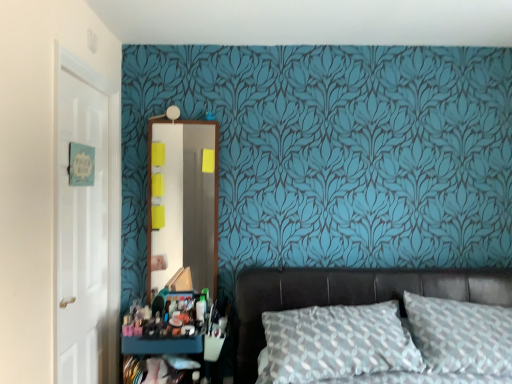
Question: From a real-world perspective, is white glossy door at left under leather bed at lower right?

Choices:
 (A) yes
 (B) no

Answer: (B)

Question: Is white glossy door at left behind leather bed at lower right?

Choices:
 (A) no
 (B) yes

Answer: (A)

Question: Considering the relative positions of white glossy door at left and leather bed at lower right in the image provided, is white glossy door at left in front of leather bed at lower right?

Choices:
 (A) yes
 (B) no

Answer: (A)

Question: Can you confirm if white glossy door at left is taller than leather bed at lower right?

Choices:
 (A) no
 (B) yes

Answer: (B)

Question: Does white glossy door at left have a lesser height compared to leather bed at lower right?

Choices:
 (A) no
 (B) yes

Answer: (A)

Question: Is matte plastic makeup at lower left taller or shorter than textured gray pillow at center?

Choices:
 (A) short
 (B) tall

Answer: (A)

Question: In terms of size, does matte plastic makeup at lower left appear bigger or smaller than textured gray pillow at center?

Choices:
 (A) big
 (B) small

Answer: (B)

Question: Based on their positions, is matte plastic makeup at lower left located to the left or right of textured gray pillow at center?

Choices:
 (A) right
 (B) left

Answer: (B)

Question: Is matte plastic makeup at lower left inside the boundaries of textured gray pillow at center, or outside?

Choices:
 (A) outside
 (B) inside

Answer: (A)

Question: Considering the positions of matte black dresser at lower left and leather bed at lower right in the image, is matte black dresser at lower left bigger or smaller than leather bed at lower right?

Choices:
 (A) small
 (B) big

Answer: (A)

Question: From their relative heights in the image, would you say matte black dresser at lower left is taller or shorter than leather bed at lower right?

Choices:
 (A) short
 (B) tall

Answer: (A)

Question: Is matte black dresser at lower left in front of or behind leather bed at lower right in the image?

Choices:
 (A) front
 (B) behind

Answer: (B)

Question: From the image's perspective, relative to leather bed at lower right, is matte black dresser at lower left above or below?

Choices:
 (A) below
 (B) above

Answer: (A)

Question: Considering the relative positions of white glossy door at left and leather bed at lower right in the image provided, is white glossy door at left to the left or to the right of leather bed at lower right?

Choices:
 (A) right
 (B) left

Answer: (B)

Question: Looking at the image, does white glossy door at left seem bigger or smaller compared to leather bed at lower right?

Choices:
 (A) small
 (B) big

Answer: (A)